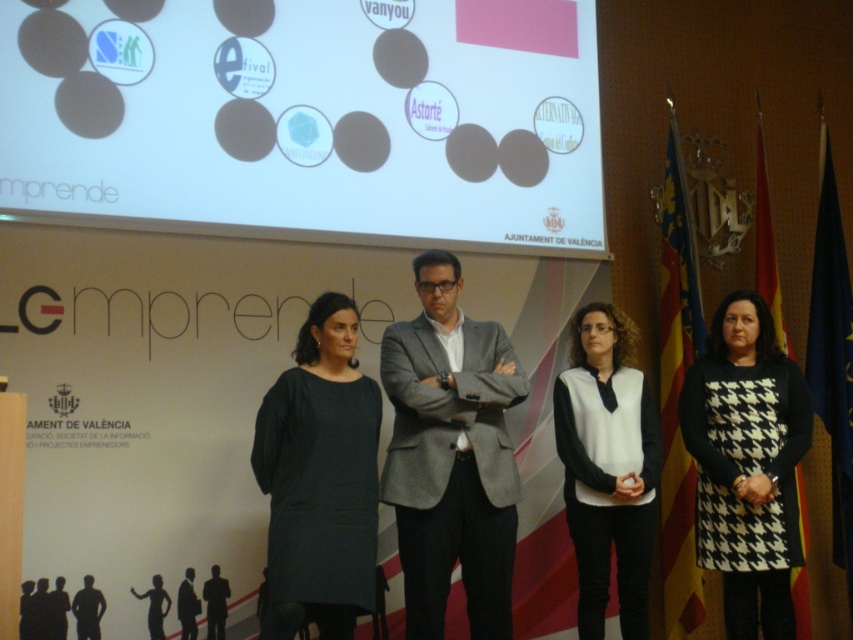
Question: Is white matte screen at upper center wider than gray wool suit at center?

Choices:
 (A) no
 (B) yes

Answer: (B)

Question: Considering the relative positions of white matte screen at upper center and black houndstooth dress at right in the image provided, where is white matte screen at upper center located with respect to black houndstooth dress at right?

Choices:
 (A) left
 (B) right

Answer: (A)

Question: Which of the following is the closest to the observer?

Choices:
 (A) (764, 358)
 (B) (457, 422)

Answer: (B)

Question: Which object appears farthest from the camera in this image?

Choices:
 (A) dark gray suit at center
 (B) black houndstooth dress at right

Answer: (B)

Question: Can you confirm if white matte screen at upper center is wider than matte black suit at center?

Choices:
 (A) yes
 (B) no

Answer: (A)

Question: Estimate the real-world distances between objects in this image. Which object is farther from the black houndstooth dress at right?

Choices:
 (A) gray wool suit at center
 (B) dark gray dress at center

Answer: (B)